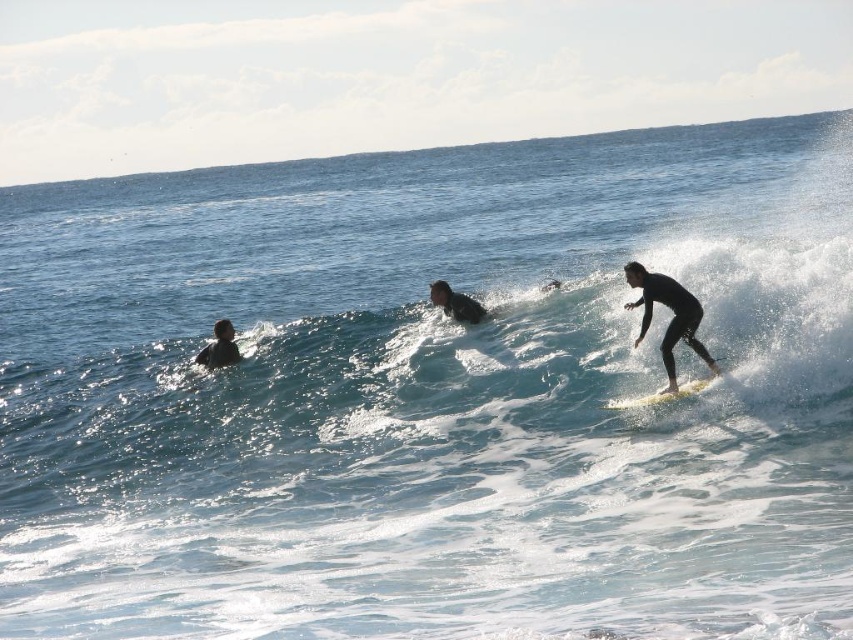
Between black matte wetsuit at right and black wetsuit surfer at center, which one appears on the right side from the viewer's perspective?

From the viewer's perspective, black matte wetsuit at right appears more on the right side.

Image resolution: width=853 pixels, height=640 pixels. What do you see at coordinates (671, 317) in the screenshot? I see `black matte wetsuit at right` at bounding box center [671, 317].

Who is more forward, (660, 291) or (440, 285)?

Positioned in front is point (660, 291).

The image size is (853, 640). Identify the location of black matte wetsuit at right. (671, 317).

Can you confirm if black matte wetsuit at right is positioned above black wetsuit at left?

Correct, black matte wetsuit at right is located above black wetsuit at left.

Between point (671, 326) and point (201, 349), which one is positioned in front?

Point (671, 326) is in front.

Which is behind, point (664, 301) or point (219, 328)?

The point (219, 328) is behind.

The image size is (853, 640). What are the coordinates of `black matte wetsuit at right` in the screenshot? It's located at (671, 317).

Can you confirm if black wetsuit surfer at center is positioned below white foam surfboard at right?

Incorrect, black wetsuit surfer at center is not positioned below white foam surfboard at right.

Is black wetsuit surfer at center shorter than white foam surfboard at right?

No, black wetsuit surfer at center is not shorter than white foam surfboard at right.

This screenshot has width=853, height=640. What do you see at coordinates (456, 304) in the screenshot?
I see `black wetsuit surfer at center` at bounding box center [456, 304].

This screenshot has width=853, height=640. I want to click on black wetsuit surfer at center, so click(456, 304).